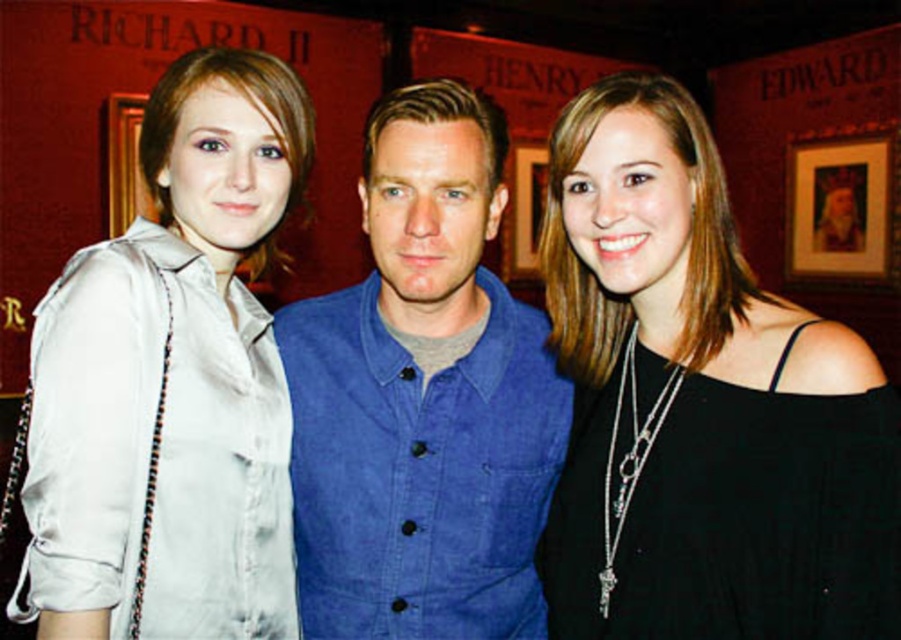
Question: Does black matte dress at center have a smaller size compared to silky beige blouse at left?

Choices:
 (A) yes
 (B) no

Answer: (A)

Question: Among these points, which one is nearest to the camera?

Choices:
 (A) (74, 477)
 (B) (730, 216)
 (C) (403, 282)

Answer: (A)

Question: Which of these objects is positioned farthest from the silky beige blouse at left?

Choices:
 (A) denim vest at center
 (B) black matte dress at center

Answer: (B)

Question: Estimate the real-world distances between objects in this image. Which object is closer to the black matte dress at center?

Choices:
 (A) silky beige blouse at left
 (B) denim vest at center

Answer: (B)

Question: Is black matte dress at center to the right of silky beige blouse at left from the viewer's perspective?

Choices:
 (A) no
 (B) yes

Answer: (B)

Question: Is silky beige blouse at left positioned before denim vest at center?

Choices:
 (A) yes
 (B) no

Answer: (A)